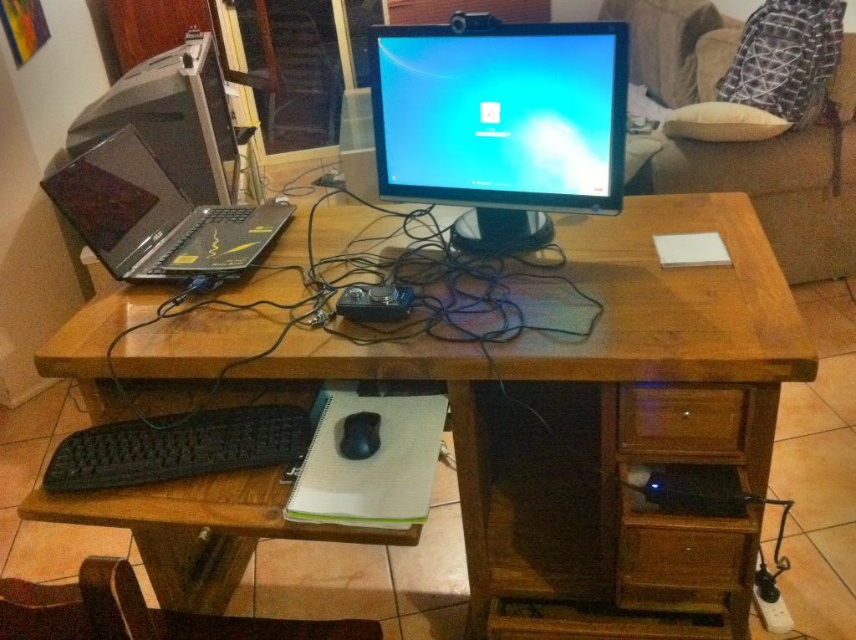
Who is lower down, wooden computer desk at center or wooden drawer at lower right?

wooden drawer at lower right is lower down.

Between wooden computer desk at center and wooden drawer at lower right, which one has more height?

wooden computer desk at center is taller.

The height and width of the screenshot is (640, 856). Identify the location of wooden computer desk at center. (545, 404).

Is wooden computer desk at center taller than satin black monitor at center?

Yes.

Who is more distant from viewer, (x=663, y=224) or (x=535, y=243)?

The point (x=663, y=224) is more distant.

At what (x,y) coordinates should I click in order to perform the action: click on wooden computer desk at center. Please return your answer as a coordinate pair (x, y). This screenshot has height=640, width=856. Looking at the image, I should click on (545, 404).

Can you confirm if satin black monitor at center is taller than brown wood drawer at lower right?

Yes, satin black monitor at center is taller than brown wood drawer at lower right.

Between satin black monitor at center and brown wood drawer at lower right, which one is positioned lower?

brown wood drawer at lower right is below.

Who is more distant from viewer, (484, 248) or (620, 397)?

The point (484, 248) is more distant.

Identify the location of satin black monitor at center. (501, 122).